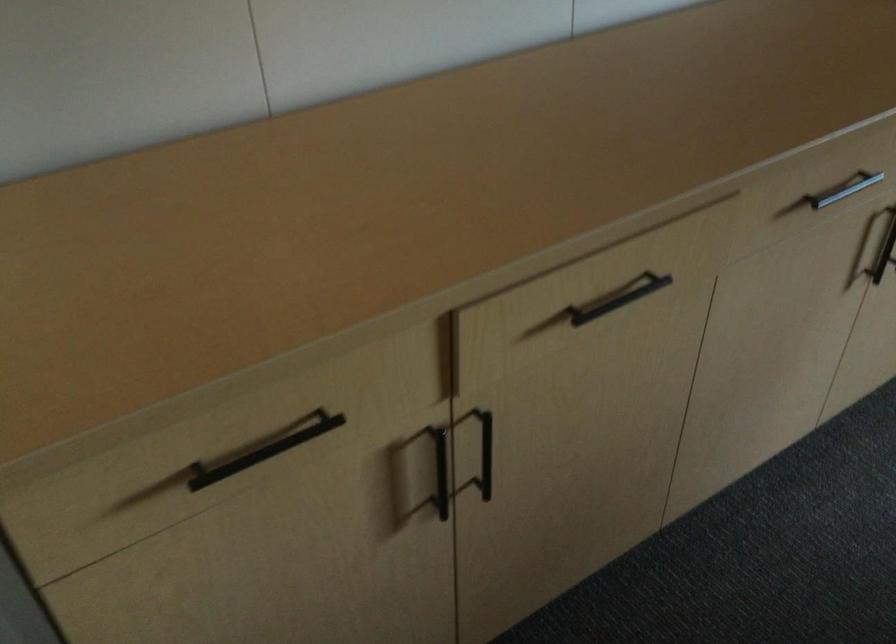
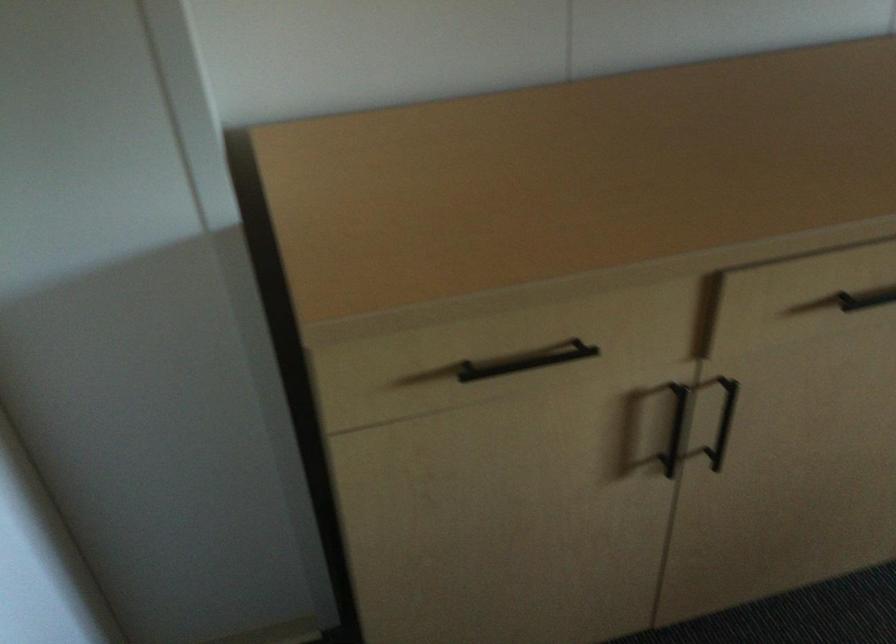
Where in the second image is the point corresponding to [440,471] from the first image?

(675, 428)